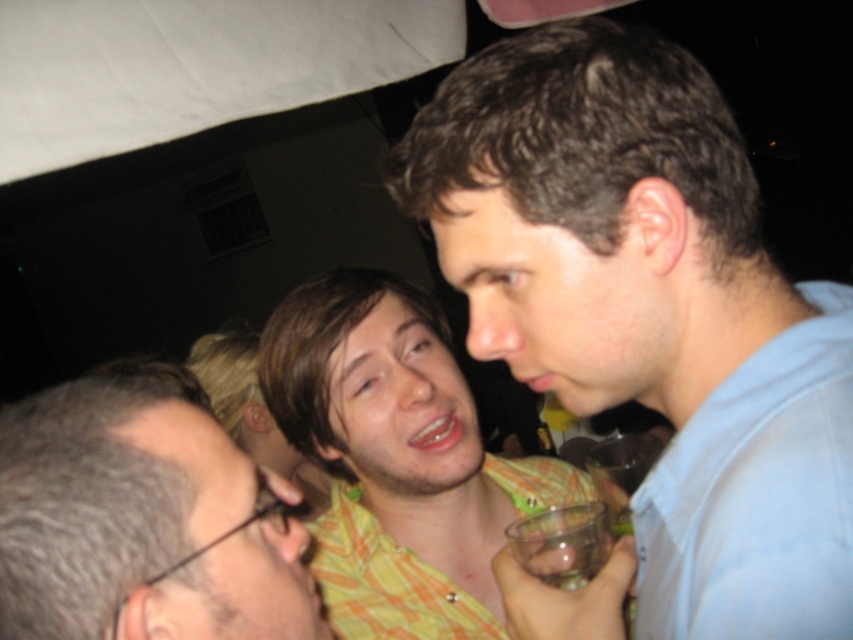
Question: Observing the image, what is the correct spatial positioning of yellow plaid shirt at center in reference to transparent plastic wine glass at lower center?

Choices:
 (A) right
 (B) left

Answer: (B)

Question: Which point appears closest to the camera in this image?

Choices:
 (A) (570, 568)
 (B) (450, 598)

Answer: (A)

Question: Can you confirm if yellow plaid shirt at center is positioned to the left of transparent plastic wine glass at lower center?

Choices:
 (A) yes
 (B) no

Answer: (A)

Question: Which object appears farthest from the camera in this image?

Choices:
 (A) transparent plastic wine glass at lower center
 (B) yellow plaid shirt at center
 (C) gray hair at lower left

Answer: (B)

Question: Does blue cotton shirt at center appear on the right side of yellow plaid shirt at center?

Choices:
 (A) no
 (B) yes

Answer: (B)

Question: Considering the real-world distances, which object is closest to the transparent plastic wine glass at lower center?

Choices:
 (A) yellow plaid shirt at center
 (B) gray hair at lower left
 (C) blue cotton shirt at center

Answer: (A)